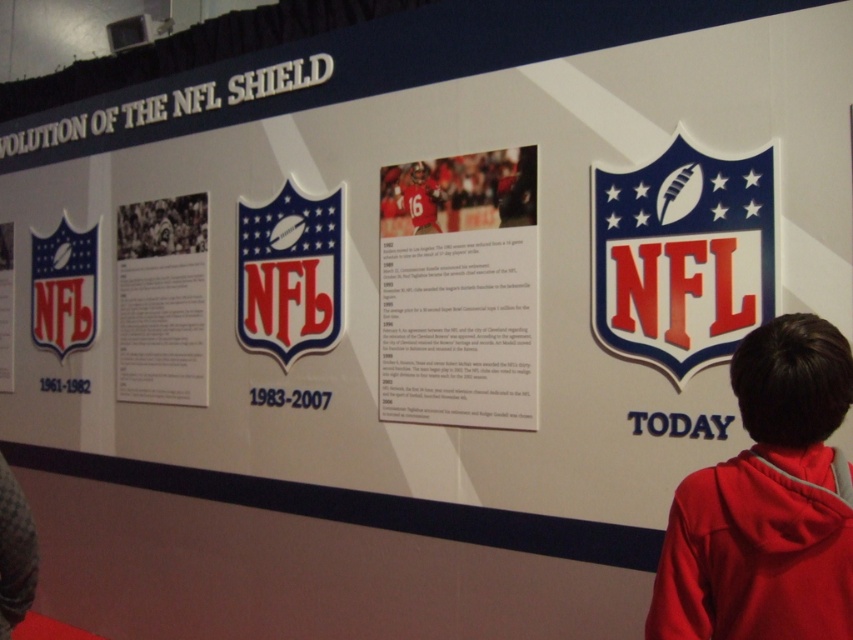
Between matte paper poster at center and matte plastic nfl shield at upper right, which one appears on the left side from the viewer's perspective?

matte paper poster at center

Identify the location of matte paper poster at center. This screenshot has width=853, height=640. (459, 291).

Does matte plastic nfl shield at center have a greater height compared to white paper at upper left?

In fact, matte plastic nfl shield at center may be shorter than white paper at upper left.

Is matte plastic nfl shield at center closer to camera compared to white paper at upper left?

Yes, it is.

Where is `matte plastic nfl shield at center`? matte plastic nfl shield at center is located at coordinates (289, 275).

Is matte paper poster at center to the left of matte jersey at center from the viewer's perspective?

In fact, matte paper poster at center is to the right of matte jersey at center.

Can you confirm if matte paper poster at center is taller than matte jersey at center?

Correct, matte paper poster at center is much taller as matte jersey at center.

Is point (386, 256) closer to viewer compared to point (421, 225)?

No, (386, 256) is behind (421, 225).

What are the coordinates of `matte paper poster at center` in the screenshot? It's located at pos(459,291).